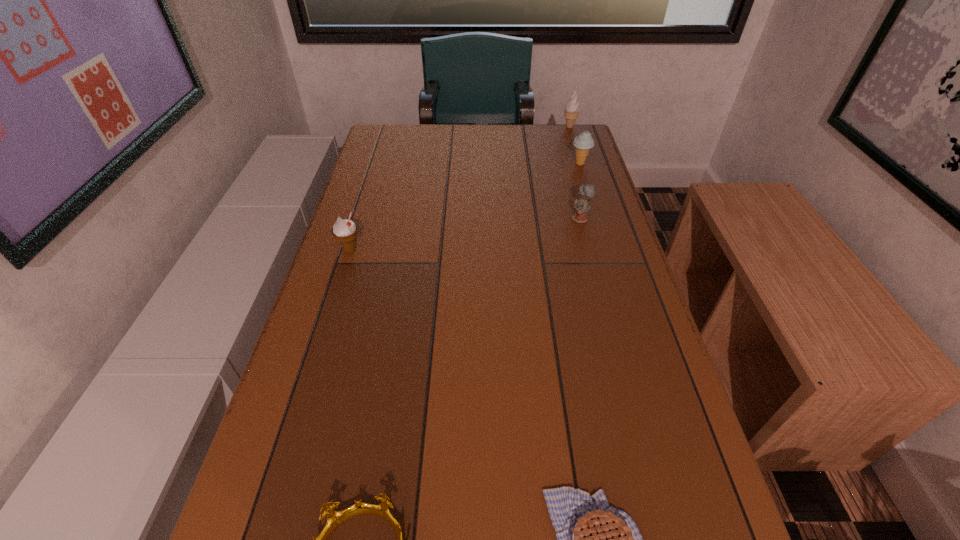
Where is `vacant space located on the front-facing side of the third farthest object`? The width and height of the screenshot is (960, 540). vacant space located on the front-facing side of the third farthest object is located at coordinates (460, 219).

The height and width of the screenshot is (540, 960). I want to click on free space located 0.350m on the front-facing side of the third farthest object, so click(445, 219).

Identify the location of free space located on the front-facing side of the third farthest object. (542, 219).

This screenshot has height=540, width=960. I want to click on free point located 0.330m on the right of the nearest icecream, so click(x=491, y=250).

Identify the location of object present at the far edge. click(572, 108).

Find the location of a particular element. The width and height of the screenshot is (960, 540). object positioned at the left edge is located at coordinates (344, 230).

At what (x,y) coordinates should I click in order to perform the action: click on teddy bear located at the right edge. Please return your answer as a coordinate pair (x, y). The width and height of the screenshot is (960, 540). Looking at the image, I should click on (581, 205).

I want to click on object located in the far right corner section of the desktop, so click(572, 108).

The image size is (960, 540). In order to click on vacant space at the far edge of the desktop in this screenshot , I will do `click(490, 147)`.

The image size is (960, 540). In the image, there is a desktop. Identify the location of blank space at the left edge. (353, 299).